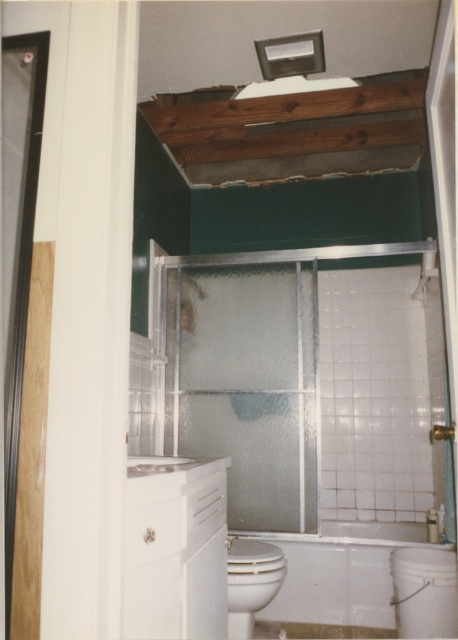
Question: Does frosted glass shower door at center appear on the right side of white glossy bathtub at lower center?

Choices:
 (A) yes
 (B) no

Answer: (B)

Question: Is the position of frosted glass shower door at center less distant than that of clear plastic screen door at left?

Choices:
 (A) yes
 (B) no

Answer: (B)

Question: Which point is closer to the camera?

Choices:
 (A) clear plastic screen door at left
 (B) white glossy bathtub at lower center
 (C) white glossy toilet bowl at lower center

Answer: (A)

Question: Can you confirm if white glossy bathtub at lower center is positioned above white glossy toilet bowl at lower center?

Choices:
 (A) no
 (B) yes

Answer: (A)

Question: Among these objects, which one is nearest to the camera?

Choices:
 (A) white glossy bathtub at lower center
 (B) frosted glass shower door at center
 (C) clear plastic screen door at left

Answer: (C)

Question: Which point appears closest to the camera in this image?

Choices:
 (A) (261, 604)
 (B) (5, 433)
 (C) (179, 296)
 (D) (414, 524)

Answer: (B)